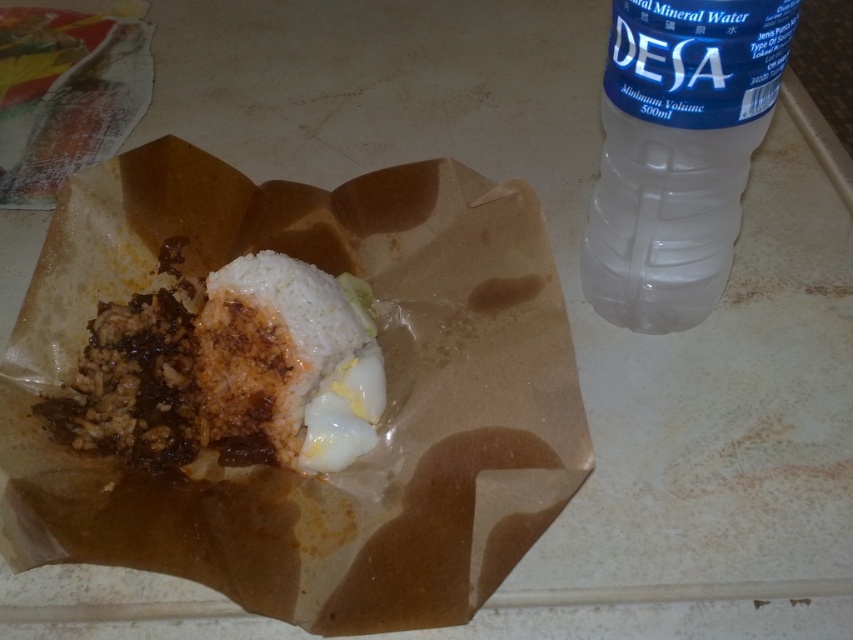
You are at a restaurant and want to grab the transparent plastic bottle at upper right to drink water. Can you reach it without moving the white matte rice at center?

The transparent plastic bottle at upper right is to the right of white matte rice at center, so you can reach it without moving the white matte rice at center since it is positioned to the side.

You are a food delivery person who needs to place a small note between the transparent plastic bottle at upper right and the white matte rice at center. The note is 3 inches wide. Can you fit it there?

The transparent plastic bottle at upper right is 16.84 inches from white matte rice at center, so yes, the 3 inch wide note can fit between them.